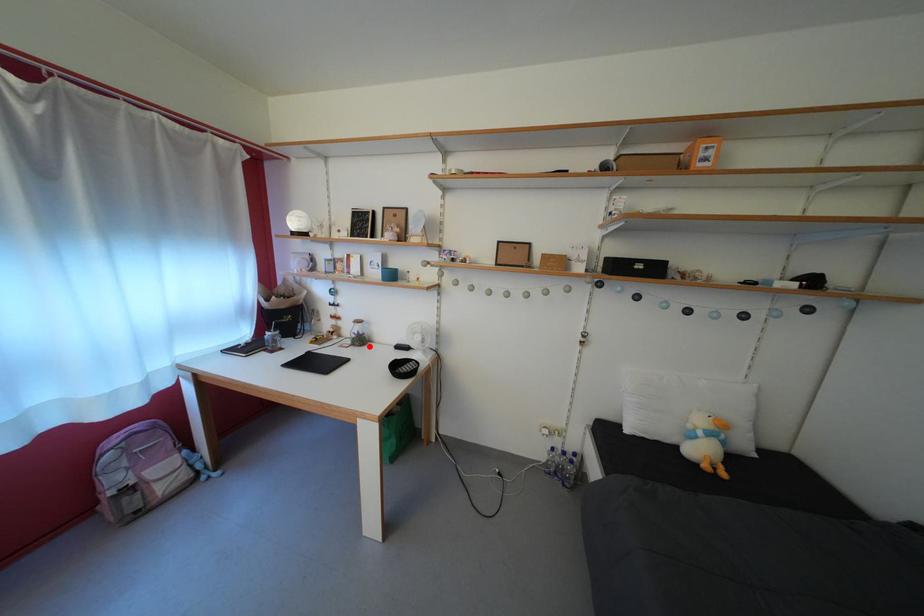
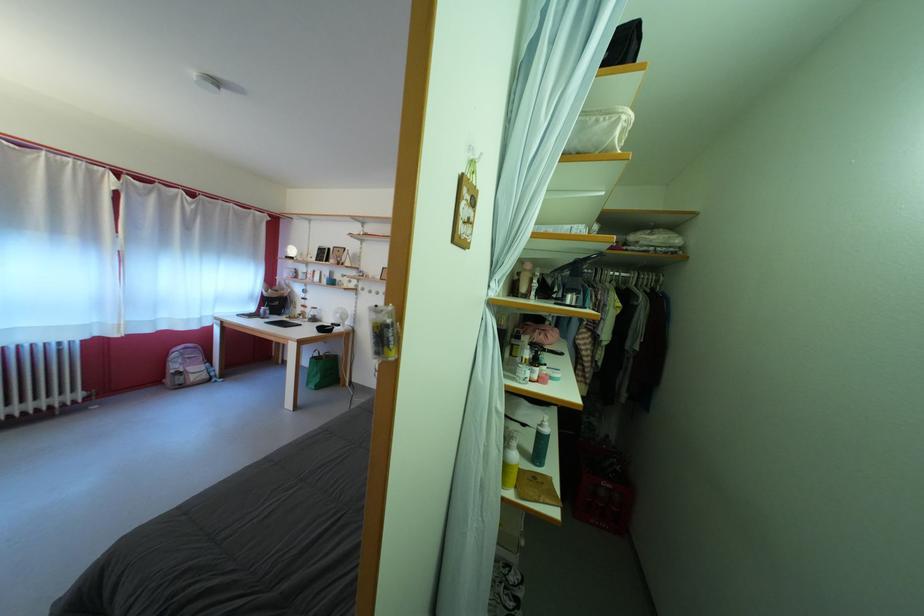
Where in the second image is the point corresponding to the highlighted location from the first image?

(322, 325)